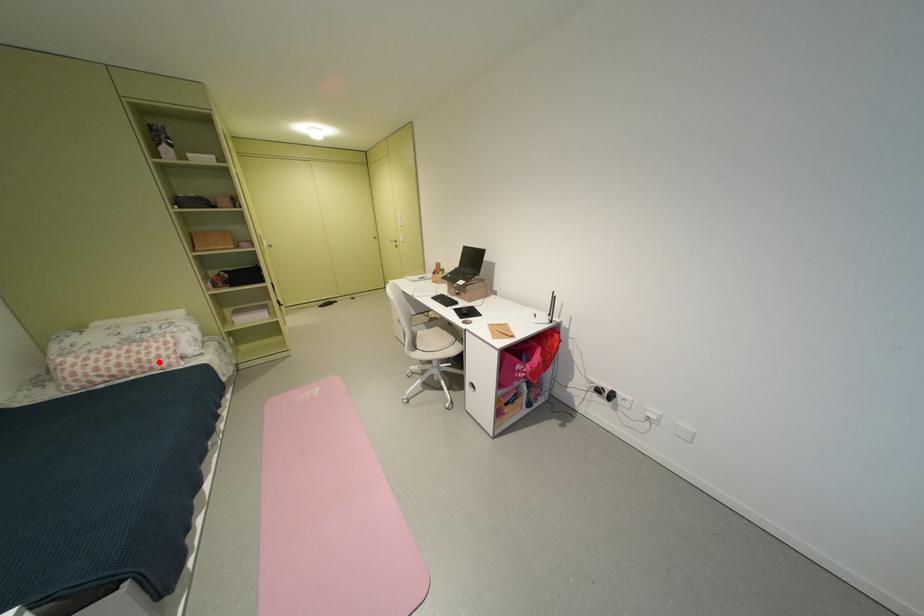
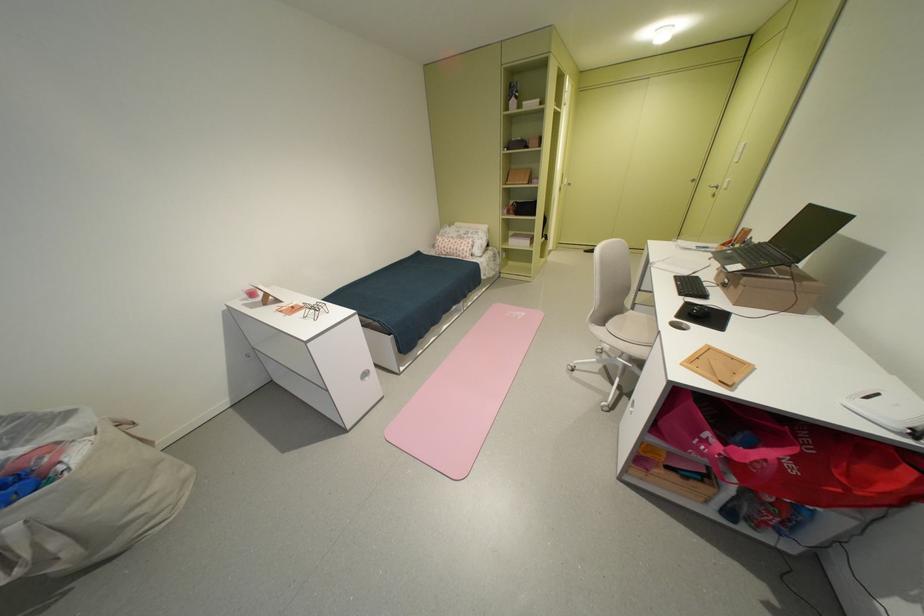
Question: A red point is marked in image1. In image2, is the corresponding 3D point closer to the camera or farther? Reply with the corresponding letter.

Choices:
 (A) The corresponding 3D point is closer.
 (B) The corresponding 3D point is farther.

Answer: (A)